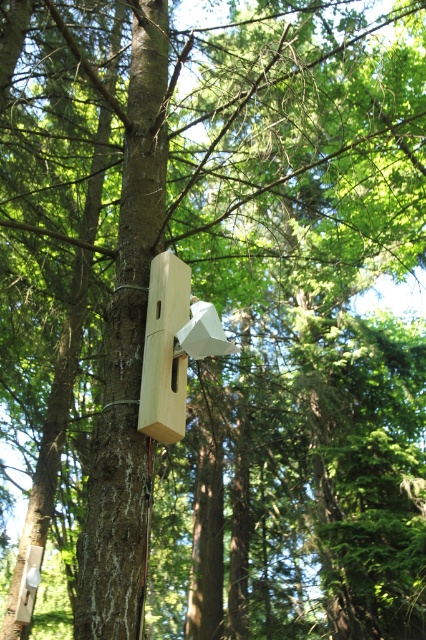
Consider the image. Can you confirm if smooth brown tree trunk at center is positioned to the left of natural wood bird feeder at center?

Correct, you'll find smooth brown tree trunk at center to the left of natural wood bird feeder at center.

Which of these two, smooth brown tree trunk at center or natural wood bird feeder at center, stands shorter?

With less height is natural wood bird feeder at center.

Looking at this image, who is more distant from viewer, [108,420] or [193,330]?

The point [108,420] is more distant.

Locate an element on the screen. The image size is (426, 640). smooth brown tree trunk at center is located at coordinates (126, 353).